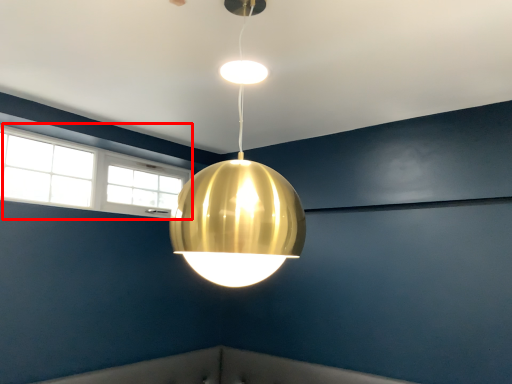
Question: In this image, where is window (annotated by the red box) located relative to lamp?

Choices:
 (A) left
 (B) right

Answer: (A)